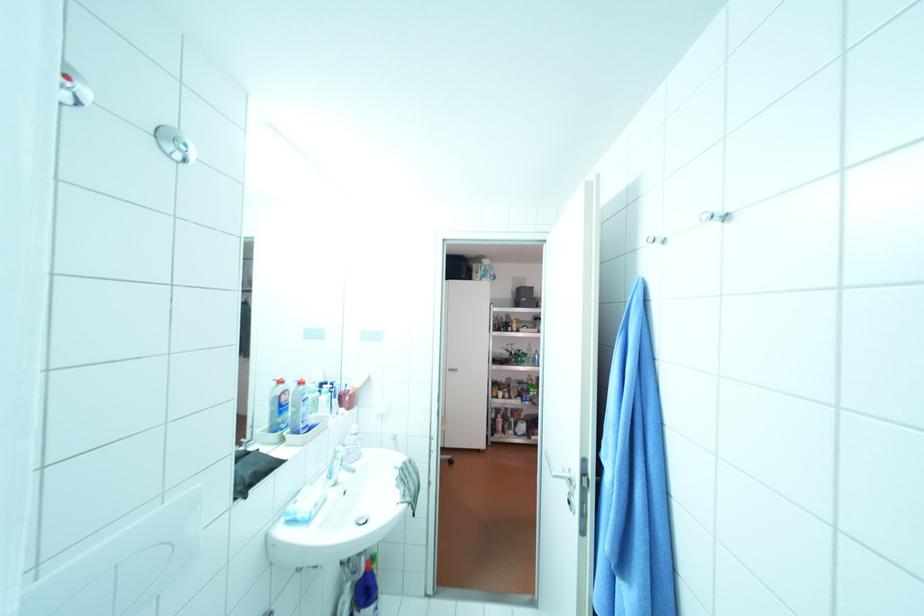
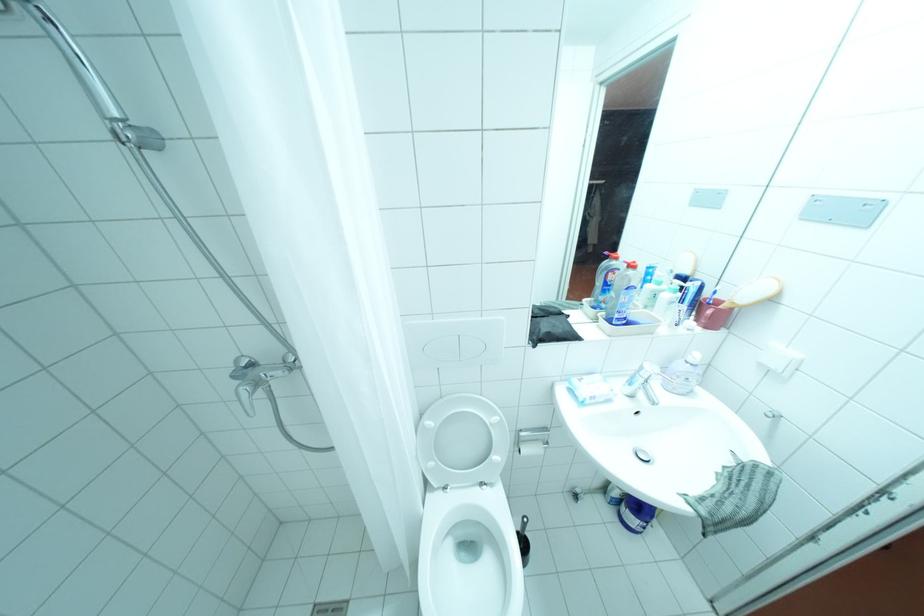
The images are taken continuously from a first-person perspective. In which direction is your viewpoint rotating?

The camera's rotation is toward left-down.